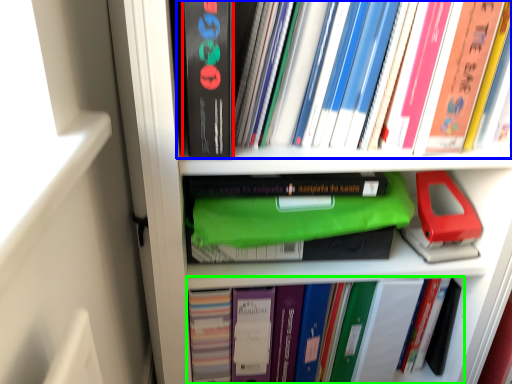
Question: Based on their relative distances, which object is farther from paperback book (highlighted by a red box)? Choose from book (highlighted by a blue box) and book (highlighted by a green box).

Choices:
 (A) book
 (B) book

Answer: (B)